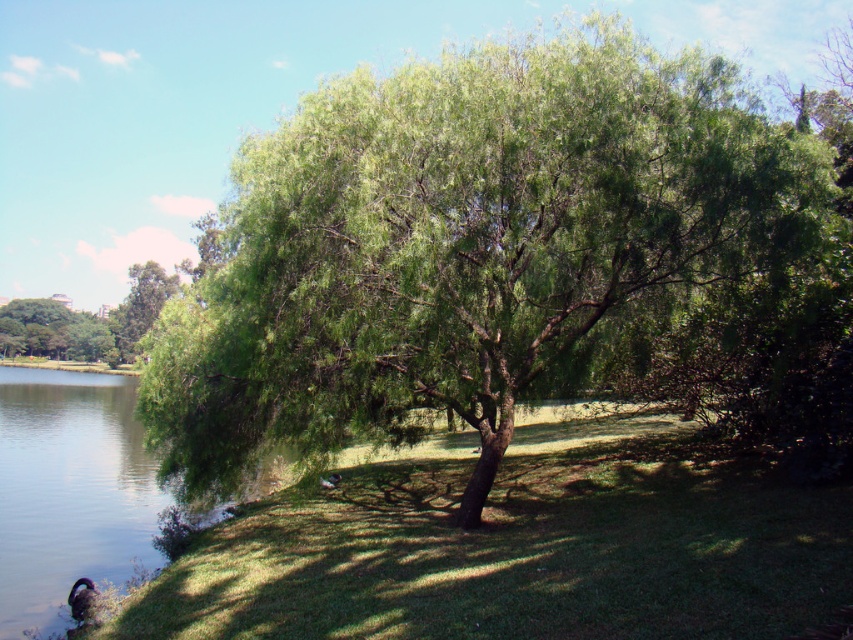
Which is below, green grass at center or clear water at lower left?

clear water at lower left is lower down.

Is point (300, 557) less distant than point (71, 508)?

Yes, point (300, 557) is closer to viewer.

Where is `green grass at center`? green grass at center is located at coordinates (521, 547).

Identify the location of green grass at center. The image size is (853, 640). (521, 547).

Can you confirm if clear water at lower left is positioned to the right of green leafy tree at upper left?

Yes, clear water at lower left is to the right of green leafy tree at upper left.

Does clear water at lower left have a lesser height compared to green leafy tree at upper left?

Yes, clear water at lower left is shorter than green leafy tree at upper left.

The height and width of the screenshot is (640, 853). Describe the element at coordinates (68, 490) in the screenshot. I see `clear water at lower left` at that location.

The height and width of the screenshot is (640, 853). In order to click on clear water at lower left in this screenshot , I will do `click(68, 490)`.

Who is positioned more to the left, green leafy tree at center or green leafy tree at upper left?

green leafy tree at upper left

Which is behind, point (268, 227) or point (131, 280)?

Positioned behind is point (131, 280).

The width and height of the screenshot is (853, 640). I want to click on green leafy tree at center, so click(463, 243).